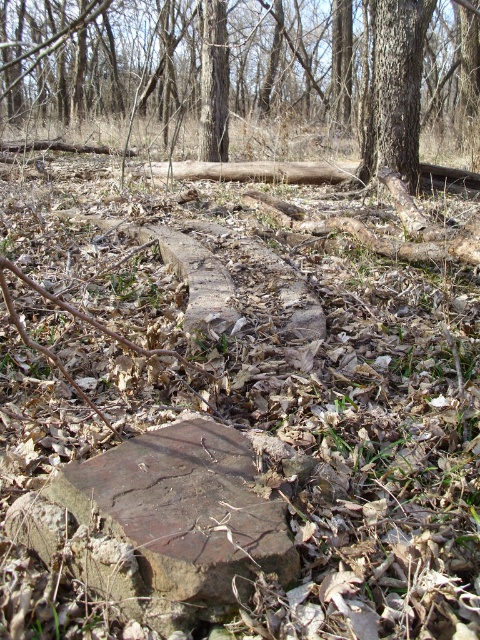
Is brown rough stone at center positioned in front of rough bark tree at upper center?

That is True.

Does brown rough stone at center lie behind rough bark tree at upper center?

No, brown rough stone at center is in front of rough bark tree at upper center.

Is point (67, 490) less distant than point (372, 64)?

Yes, point (67, 490) is closer to viewer.

The image size is (480, 640). Find the location of `brown rough stone at center`. brown rough stone at center is located at coordinates (186, 509).

What do you see at coordinates (249, 67) in the screenshot?
I see `smooth brown log at center` at bounding box center [249, 67].

Can you confirm if smooth brown log at center is positioned below brown rough stone at center?

Actually, smooth brown log at center is above brown rough stone at center.

This screenshot has width=480, height=640. I want to click on smooth brown log at center, so click(249, 67).

Does smooth brown log at center have a larger size compared to rough bark tree at upper center?

Indeed, smooth brown log at center has a larger size compared to rough bark tree at upper center.

Describe the element at coordinates (249, 67) in the screenshot. The width and height of the screenshot is (480, 640). I see `smooth brown log at center` at that location.

Where is `smooth brown log at center`? smooth brown log at center is located at coordinates (249, 67).